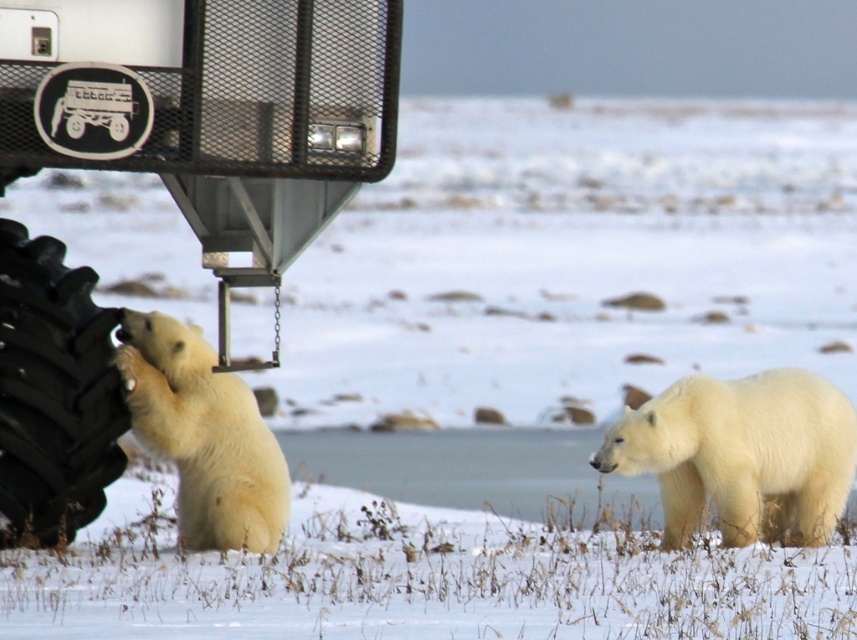
Question: Is white fluffy polar bear at right positioned behind white fur polar bear at center?

Choices:
 (A) no
 (B) yes

Answer: (B)

Question: Which object appears closest to the camera in this image?

Choices:
 (A) black rubber tire at lower left
 (B) brushed metal monster truck at left

Answer: (B)

Question: Is white fluffy polar bear at right smaller than black rubber tire at lower left?

Choices:
 (A) no
 (B) yes

Answer: (A)

Question: Which point is closer to the camera?

Choices:
 (A) (190, 506)
 (B) (0, 385)
 (C) (787, 460)
 (D) (81, 90)

Answer: (D)

Question: Is white fluffy polar bear at right positioned at the back of black rubber tire at lower left?

Choices:
 (A) yes
 (B) no

Answer: (A)

Question: Among these objects, which one is nearest to the camera?

Choices:
 (A) white fluffy polar bear at right
 (B) brushed metal monster truck at left
 (C) white fur polar bear at center
 (D) black rubber tire at lower left

Answer: (B)